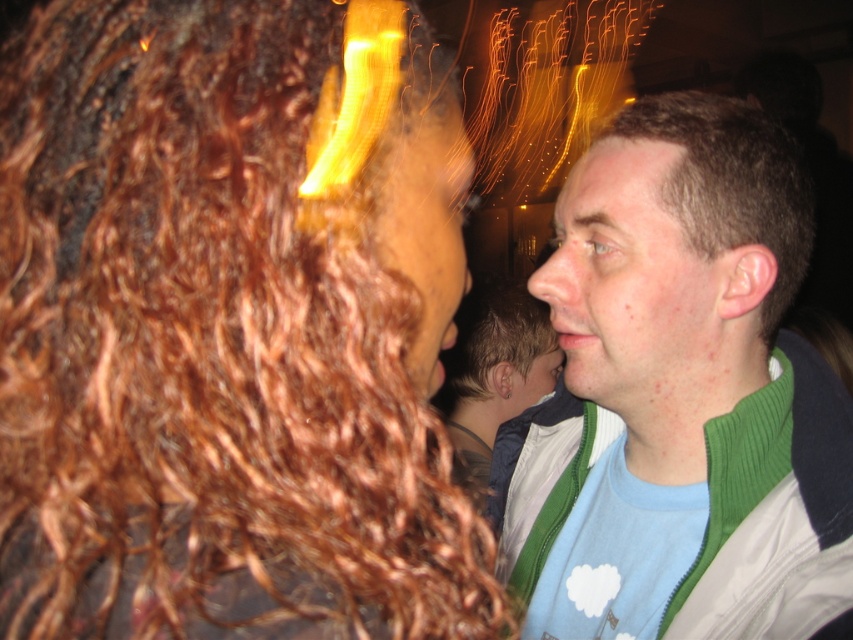
Question: Can you confirm if copper curly hair at left is positioned above brown curly hair at center?

Choices:
 (A) yes
 (B) no

Answer: (A)

Question: Which of the following is the closest to the observer?

Choices:
 (A) (376, 376)
 (B) (459, 388)

Answer: (A)

Question: Which of the following is the farthest from the observer?

Choices:
 (A) (444, 390)
 (B) (233, 346)
 (C) (479, 307)

Answer: (A)

Question: Which object is closer to the camera taking this photo?

Choices:
 (A) green corduroy jacket at right
 (B) brown matte hair at right
 (C) copper curly hair at left

Answer: (C)

Question: Is light brown hair at center to the left of brown curly hair at center from the viewer's perspective?

Choices:
 (A) yes
 (B) no

Answer: (A)

Question: Can you confirm if copper curly hair at left is wider than brown matte hair at right?

Choices:
 (A) yes
 (B) no

Answer: (B)